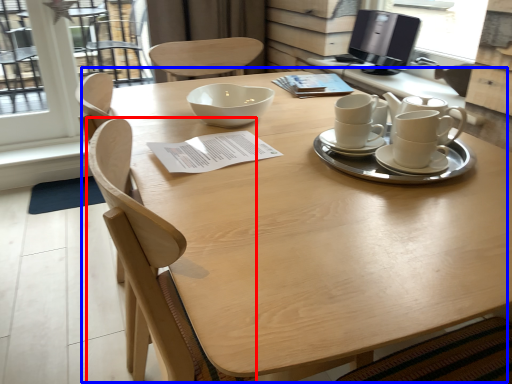
Question: Which point is further to the camera, chair (highlighted by a red box) or table (highlighted by a blue box)?

Choices:
 (A) chair
 (B) table

Answer: (A)